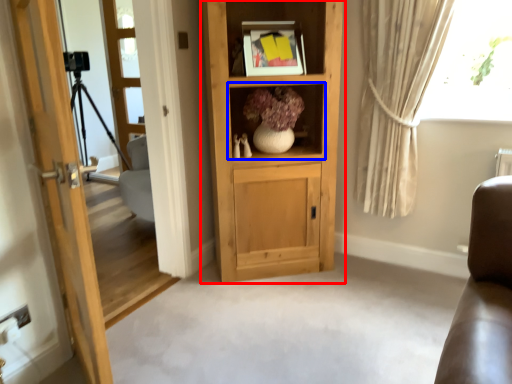
Question: Which object appears farthest to the camera in this image, cabinetry (highlighted by a red box) or shelf (highlighted by a blue box)?

Choices:
 (A) cabinetry
 (B) shelf

Answer: (B)